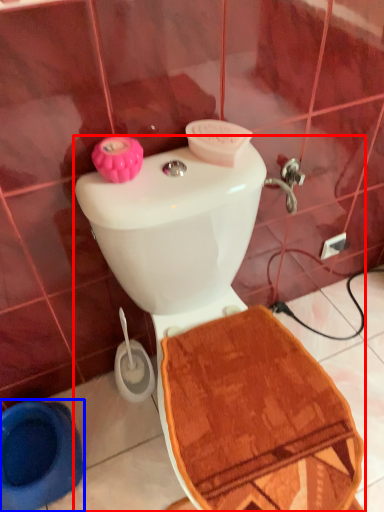
Question: Which of the following is the closest to the observer, toilet (highlighted by a red box) or toilet bowl (highlighted by a blue box)?

Choices:
 (A) toilet
 (B) toilet bowl

Answer: (A)